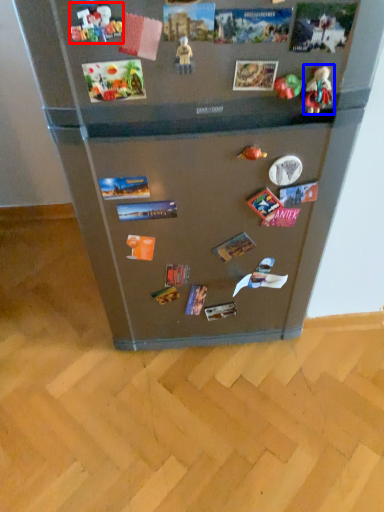
Question: Which object appears closest to the camera in this image, toy (highlighted by a red box) or toy (highlighted by a blue box)?

Choices:
 (A) toy
 (B) toy

Answer: (A)